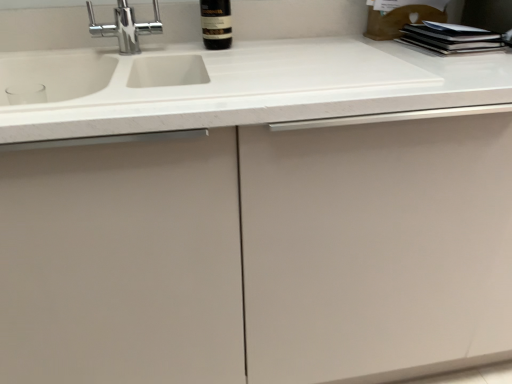
Identify the location of white matte countertop at center. (242, 86).

What do you see at coordinates (242, 86) in the screenshot? I see `white matte countertop at center` at bounding box center [242, 86].

What do you see at coordinates (216, 24) in the screenshot? I see `dark glass bottle at upper center` at bounding box center [216, 24].

In order to face dark glass bottle at upper center, should I rotate leftwards or rightwards?

It's best to rotate left around 5.299 degrees.

In order to click on dark glass bottle at upper center in this screenshot , I will do `click(216, 24)`.

Measure the distance between dark glass bottle at upper center and camera.

The distance of dark glass bottle at upper center from camera is 1.05 meters.

At what (x,y) coordinates should I click in order to perform the action: click on white matte countertop at center. Please return your answer as a coordinate pair (x, y). This screenshot has width=512, height=384. Looking at the image, I should click on (242, 86).

Between dark glass bottle at upper center and white matte countertop at center, which one appears on the left side from the viewer's perspective?

From the viewer's perspective, white matte countertop at center appears more on the left side.

Which object is closer to the camera, dark glass bottle at upper center or white matte countertop at center?

white matte countertop at center.

Does point (220, 27) come in front of point (224, 82)?

No, it is not.

From the image's perspective, is dark glass bottle at upper center positioned above or below white matte countertop at center?

Clearly, from the image's perspective, dark glass bottle at upper center is above white matte countertop at center.

From a real-world perspective, is dark glass bottle at upper center positioned above or below white matte countertop at center?

dark glass bottle at upper center is situated higher than white matte countertop at center in the real world.

Between dark glass bottle at upper center and white matte countertop at center, which one has larger width?

With larger width is white matte countertop at center.

Between dark glass bottle at upper center and white matte countertop at center, which one has less height?

white matte countertop at center is shorter.

Can you confirm if dark glass bottle at upper center is smaller than white matte countertop at center?

Yes, dark glass bottle at upper center is smaller than white matte countertop at center.

Is dark glass bottle at upper center completely or partially outside of white matte countertop at center?

Yes, dark glass bottle at upper center is not within white matte countertop at center.

Is there a large distance between dark glass bottle at upper center and white matte countertop at center?

That's not correct — dark glass bottle at upper center is a little close to white matte countertop at center.

Is dark glass bottle at upper center looking in the opposite direction of white matte countertop at center?

No, white matte countertop at center is not at the back of dark glass bottle at upper center.

Measure the distance between dark glass bottle at upper center and white matte countertop at center.

dark glass bottle at upper center and white matte countertop at center are 12.73 inches apart from each other.

What are the coordinates of `bottle lying on the right of white matte countertop at center` in the screenshot? It's located at (216, 24).

Which is more to the left, white matte countertop at center or dark glass bottle at upper center?

white matte countertop at center is more to the left.

Which object is closer to the camera taking this photo, white matte countertop at center or dark glass bottle at upper center?

white matte countertop at center is closer to the camera.

Is point (103, 131) more distant than point (214, 20)?

No, it is in front of (214, 20).

From the image's perspective, is white matte countertop at center located beneath dark glass bottle at upper center?

Yes, from the image's perspective, white matte countertop at center is below dark glass bottle at upper center.

From a real-world perspective, is white matte countertop at center physically located above or below dark glass bottle at upper center?

white matte countertop at center is situated lower than dark glass bottle at upper center in the real world.

Is white matte countertop at center thinner than dark glass bottle at upper center?

Incorrect, the width of white matte countertop at center is not less than that of dark glass bottle at upper center.

Considering the sizes of white matte countertop at center and dark glass bottle at upper center in the image, is white matte countertop at center taller or shorter than dark glass bottle at upper center?

Clearly, white matte countertop at center is shorter compared to dark glass bottle at upper center.

Which of these two, white matte countertop at center or dark glass bottle at upper center, is bigger?

white matte countertop at center is bigger.

Is white matte countertop at center surrounding dark glass bottle at upper center?

No, dark glass bottle at upper center is located outside of white matte countertop at center.

Can you see white matte countertop at center touching dark glass bottle at upper center?

No, white matte countertop at center is not next to dark glass bottle at upper center.

Could you tell me if white matte countertop at center is facing dark glass bottle at upper center?

No, white matte countertop at center is not oriented towards dark glass bottle at upper center.

What's the angular difference between white matte countertop at center and dark glass bottle at upper center's facing directions?

0.0307 degrees.

Image resolution: width=512 pixels, height=384 pixels. What are the coordinates of `bottle on the right of white matte countertop at center` in the screenshot? It's located at (216, 24).

The image size is (512, 384). What are the coordinates of `countertop to the left of dark glass bottle at upper center` in the screenshot? It's located at (242, 86).

The width and height of the screenshot is (512, 384). I want to click on bottle to the right of white matte countertop at center, so click(x=216, y=24).